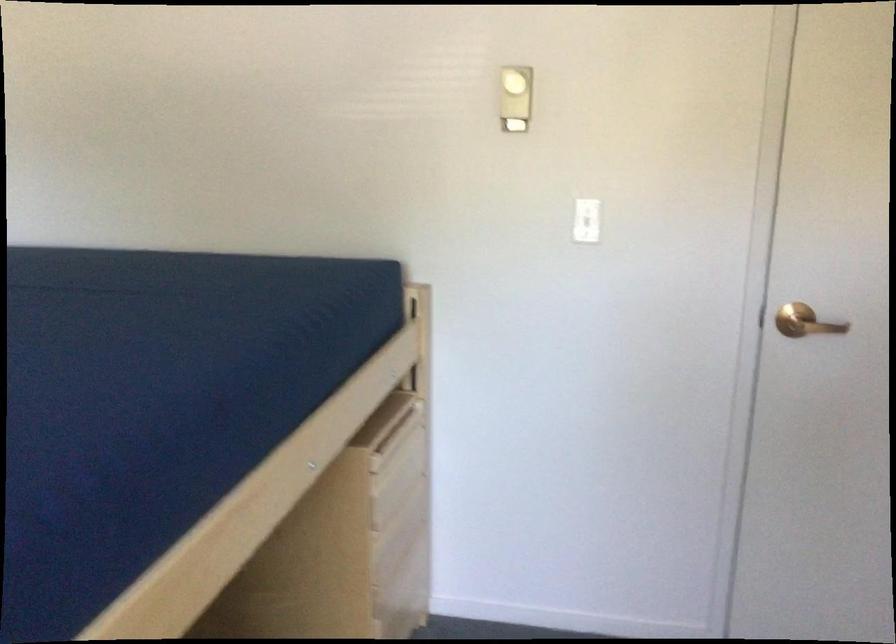
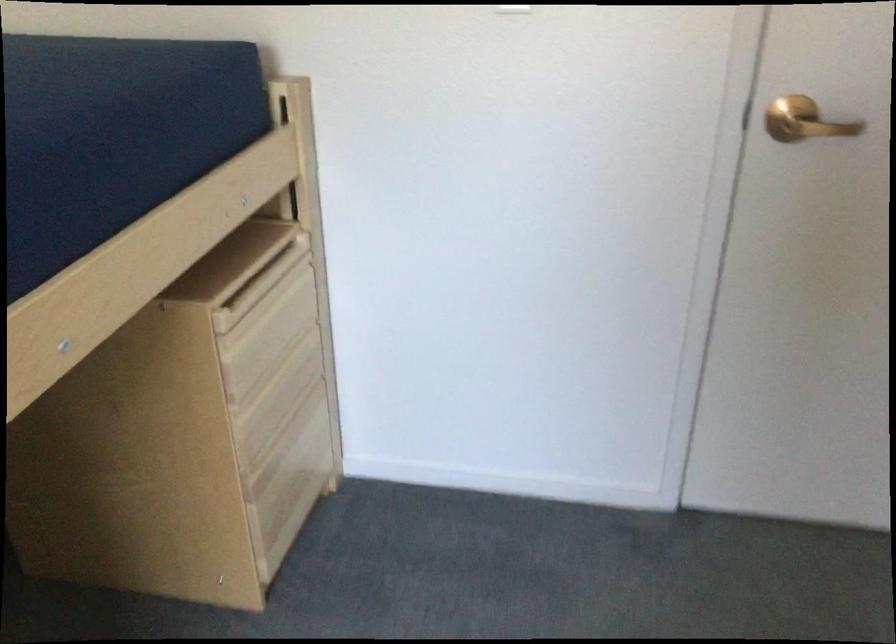
In a continuous first-person perspective shot, in which direction is the camera moving?

The cameraman moved toward right, forward.